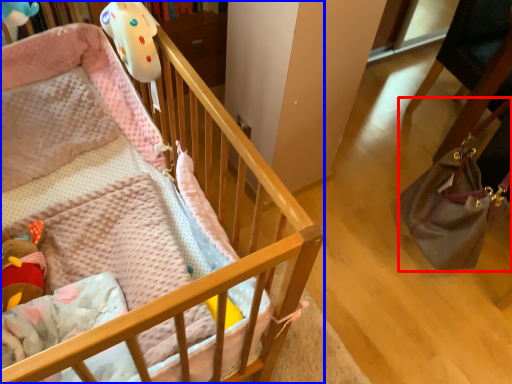
Question: Which object appears farthest to the camera in this image, handbag (highlighted by a red box) or infant bed (highlighted by a blue box)?

Choices:
 (A) handbag
 (B) infant bed

Answer: (A)